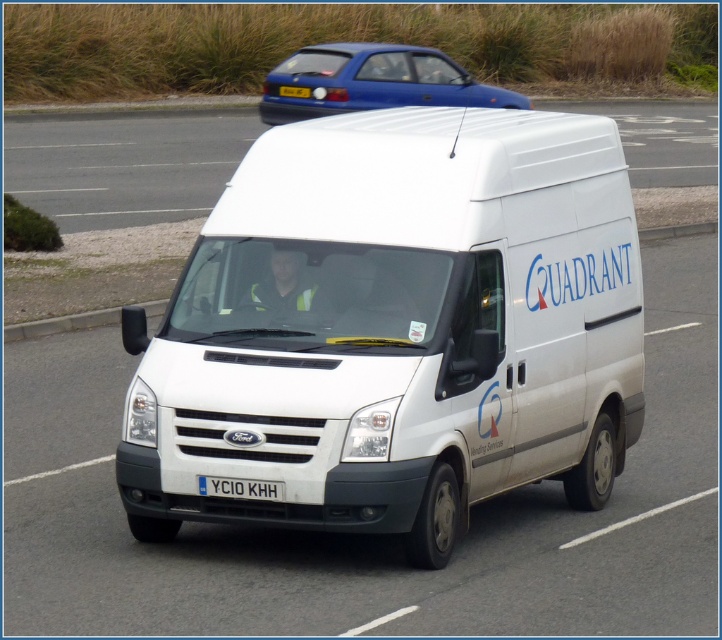
Question: Which point is closer to the camera taking this photo?

Choices:
 (A) (84, 173)
 (B) (196, 515)
 (C) (305, 97)
 (D) (279, 499)

Answer: (D)

Question: Is white glossy van at center bigger than metallic blue hatchback at upper center?

Choices:
 (A) no
 (B) yes

Answer: (B)

Question: Which object is the farthest from the metallic blue hatchback at upper center?

Choices:
 (A) white matte van at center
 (B) white plastic license plate at center

Answer: (B)

Question: Can you confirm if white matte van at center is positioned below white glossy van at center?

Choices:
 (A) no
 (B) yes

Answer: (B)

Question: Which point is closer to the camera?

Choices:
 (A) (56, 173)
 (B) (290, 58)
 (C) (305, 308)

Answer: (C)

Question: Does white glossy van at center have a lesser width compared to white plastic license plate at center?

Choices:
 (A) no
 (B) yes

Answer: (A)